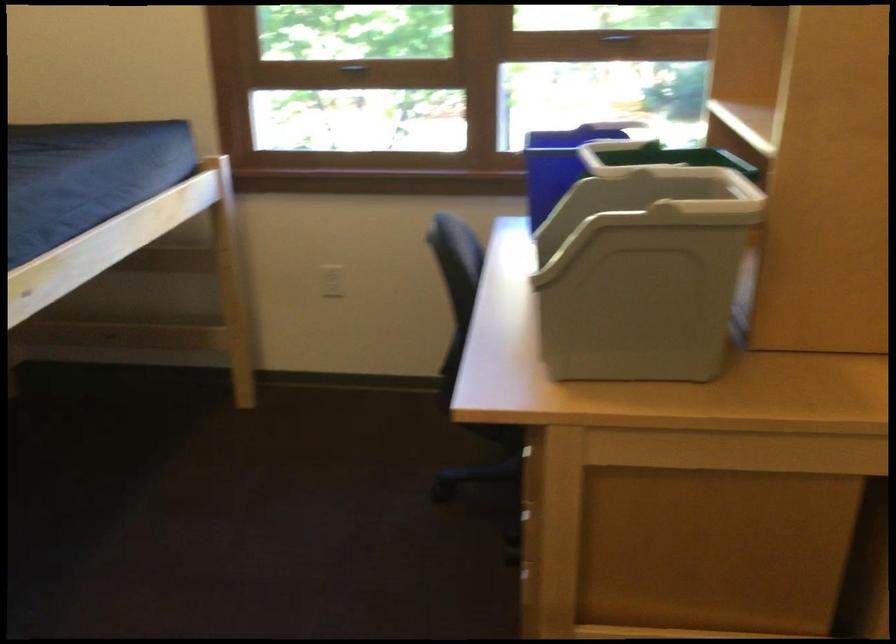
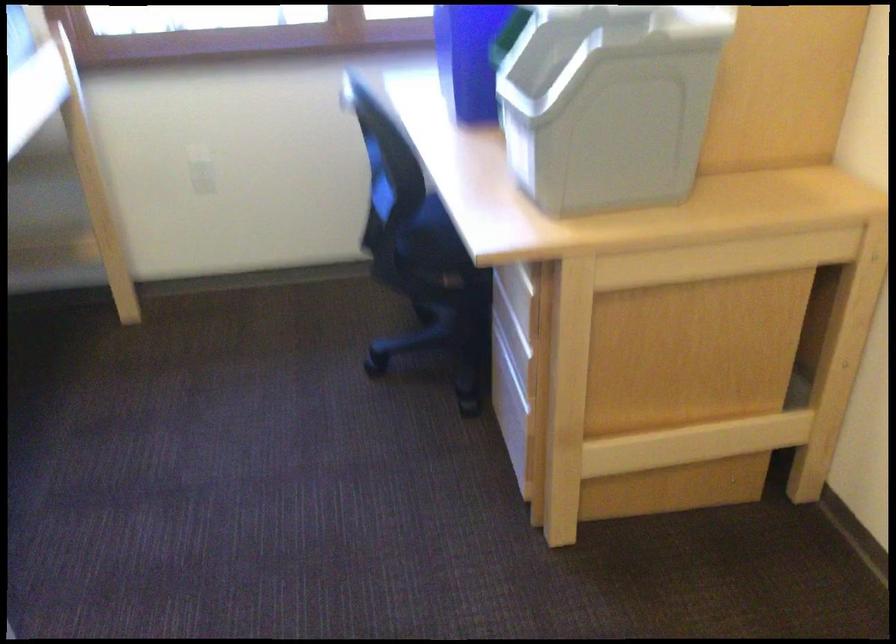
Question: What movement of the cameraman would produce the second image?

Choices:
 (A) Left
 (B) Right
 (C) Forward
 (D) Backward

Answer: (A)